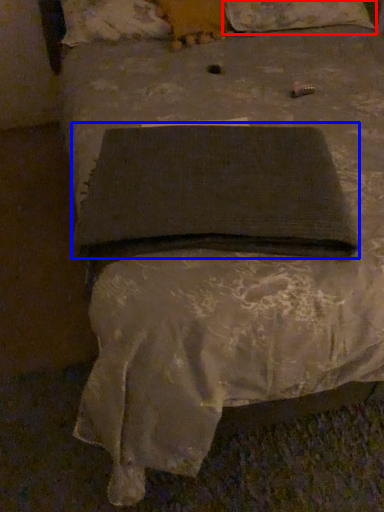
Question: Which point is closer to the camera, pillow (highlighted by a red box) or pad (highlighted by a blue box)?

Choices:
 (A) pillow
 (B) pad

Answer: (B)